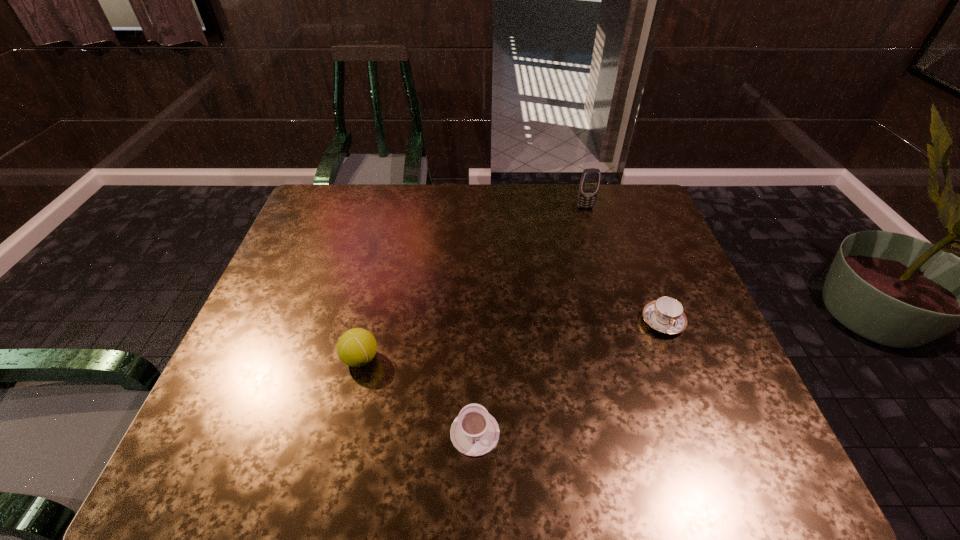
Locate an element on the screen. The image size is (960, 540). vacant space located 0.270m on the side with the handle of the third nearest object is located at coordinates (712, 449).

What are the coordinates of `object that is at the far edge` in the screenshot? It's located at (590, 180).

Locate an element on the screen. object located in the near edge section of the desktop is located at coordinates (474, 432).

Locate an element on the screen. object that is positioned at the right edge is located at coordinates (666, 314).

The height and width of the screenshot is (540, 960). I want to click on free space at the far edge, so click(x=468, y=227).

At what (x,y) coordinates should I click in order to perform the action: click on free space at the near edge of the desktop. Please return your answer as a coordinate pair (x, y). Looking at the image, I should click on (590, 446).

Image resolution: width=960 pixels, height=540 pixels. In the image, there is a desktop. In order to click on vacant space at the left edge in this screenshot , I will do 285,264.

The height and width of the screenshot is (540, 960). In the image, there is a desktop. Find the location of `free space at the right edge`. free space at the right edge is located at coordinates (681, 292).

This screenshot has height=540, width=960. In the image, there is a desktop. What are the coordinates of `free region at the near right corner` in the screenshot? It's located at (708, 444).

Find the location of a particular element. Image resolution: width=960 pixels, height=540 pixels. free area in between the third nearest object and the third object from right to left is located at coordinates (569, 377).